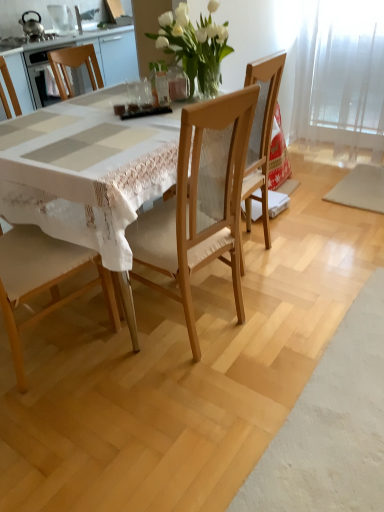
Find the location of a particular element. This screenshot has height=512, width=384. vacant location below white fabric chair at left, the second chair when ordered from right to left (from a real-world perspective) is located at coordinates (39, 352).